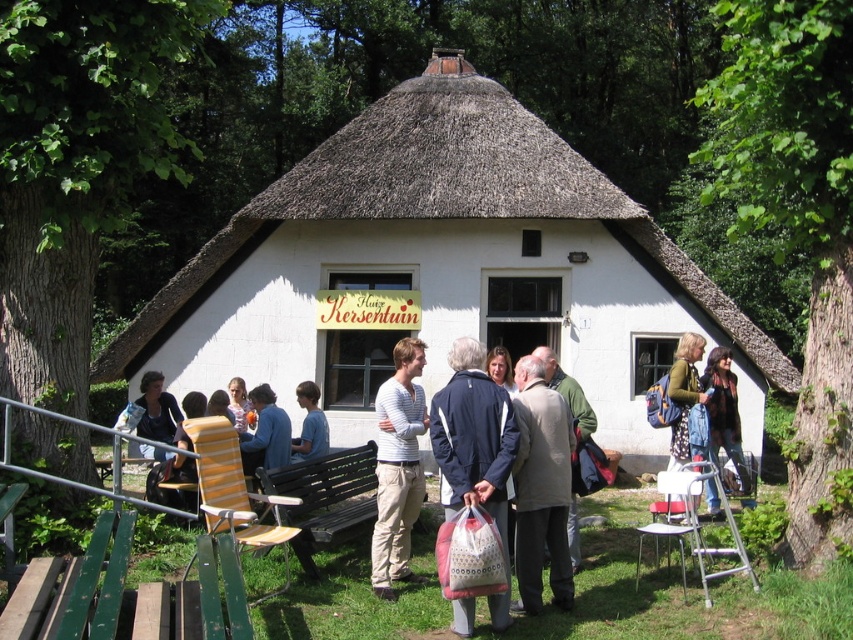
Question: Where is white thatched roof cottage at center located in relation to light brown wool coat at center in the image?

Choices:
 (A) right
 (B) left

Answer: (B)

Question: Is the position of blue fabric jacket at center less distant than that of light pink fabric dress at center?

Choices:
 (A) no
 (B) yes

Answer: (B)

Question: Is plaid shirt at center to the right of light pink fabric dress at center from the viewer's perspective?

Choices:
 (A) yes
 (B) no

Answer: (A)

Question: Estimate the real-world distances between objects in this image. Which object is farther from the light brown leather jacket at center?

Choices:
 (A) blue denim jacket at center
 (B) blue denim shirt at center

Answer: (B)

Question: Which point is farther to the camera?

Choices:
 (A) (230, 397)
 (B) (712, 428)
 (C) (405, 337)
 (D) (222, 369)

Answer: (D)

Question: Which object is closer to the camera taking this photo?

Choices:
 (A) blue denim jacket at center
 (B) blue cotton shirt at center
 (C) blue denim shirt at center
 (D) light brown wool coat at center

Answer: (D)